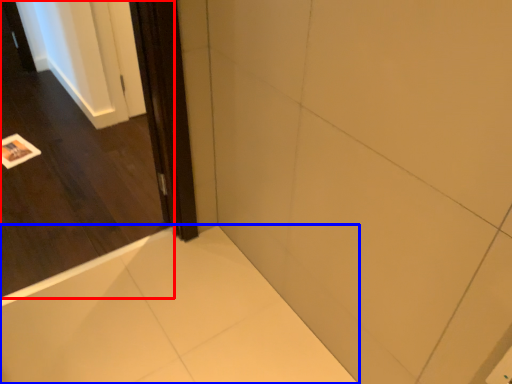
Question: Which of the following is the closest to the observer, door (highlighted by a red box) or bath (highlighted by a blue box)?

Choices:
 (A) door
 (B) bath

Answer: (A)